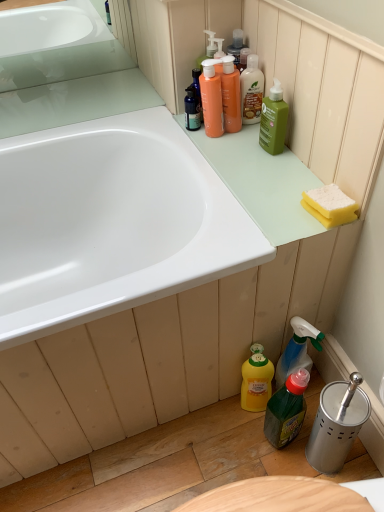
At what (x,y) coordinates should I click in order to perform the action: click on vacant space that is to the left of yellow sponge at upper right. Please return your answer as a coordinate pair (x, y). This screenshot has height=512, width=384. Looking at the image, I should click on (256, 214).